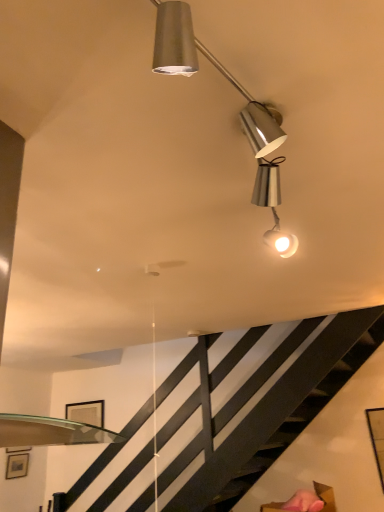
Identify the location of blank space situated above metallic silver lamp at upper center (from a real-world perspective). (250, 97).